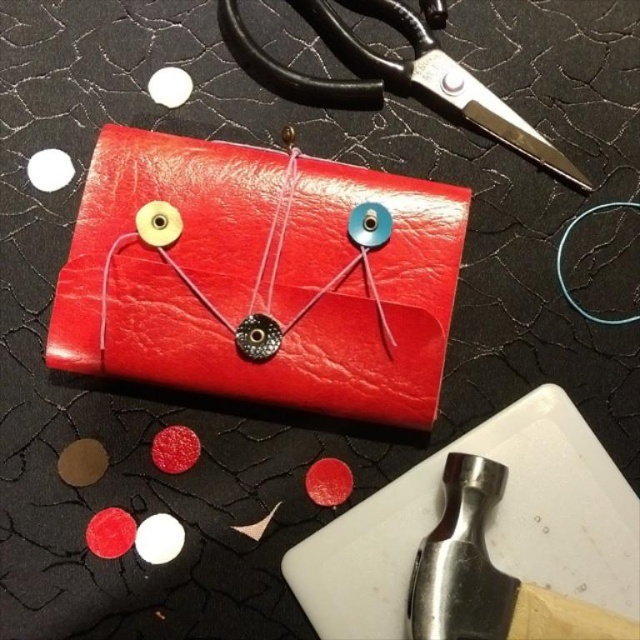
Question: Which point is closer to the camera?

Choices:
 (A) (444, 621)
 (B) (410, 35)

Answer: (A)

Question: Is polished metal hammer at bottom right closer to the viewer compared to black metal scissors at upper center?

Choices:
 (A) yes
 (B) no

Answer: (A)

Question: Does polished metal hammer at bottom right have a lesser width compared to black metal scissors at upper center?

Choices:
 (A) no
 (B) yes

Answer: (B)

Question: Is glossy leather clutch at center thinner than black metal scissors at upper center?

Choices:
 (A) yes
 (B) no

Answer: (B)

Question: Which of the following is the closest to the observer?

Choices:
 (A) (465, 202)
 (B) (499, 109)
 (C) (449, 529)

Answer: (C)

Question: Which point is closer to the camera?

Choices:
 (A) (243, 58)
 (B) (416, 563)

Answer: (B)